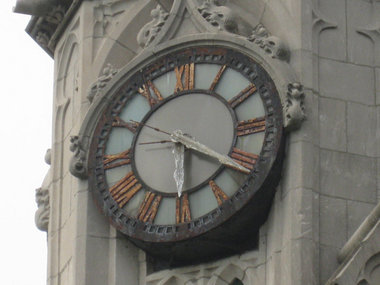
At what (x,y) coordinates should I click in order to perform the action: click on clock center. Please return your answer as a coordinate pair (x, y). Looking at the image, I should click on (178, 133).